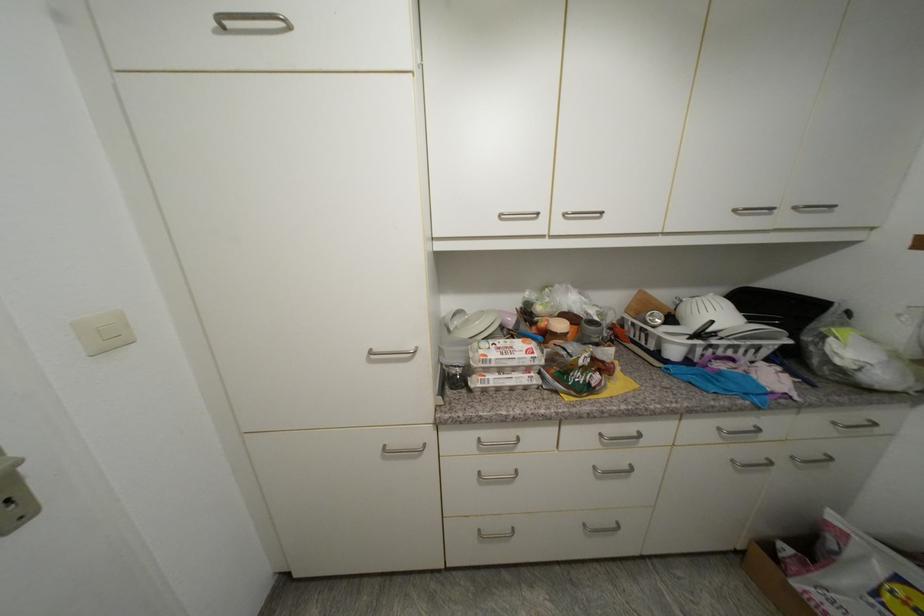
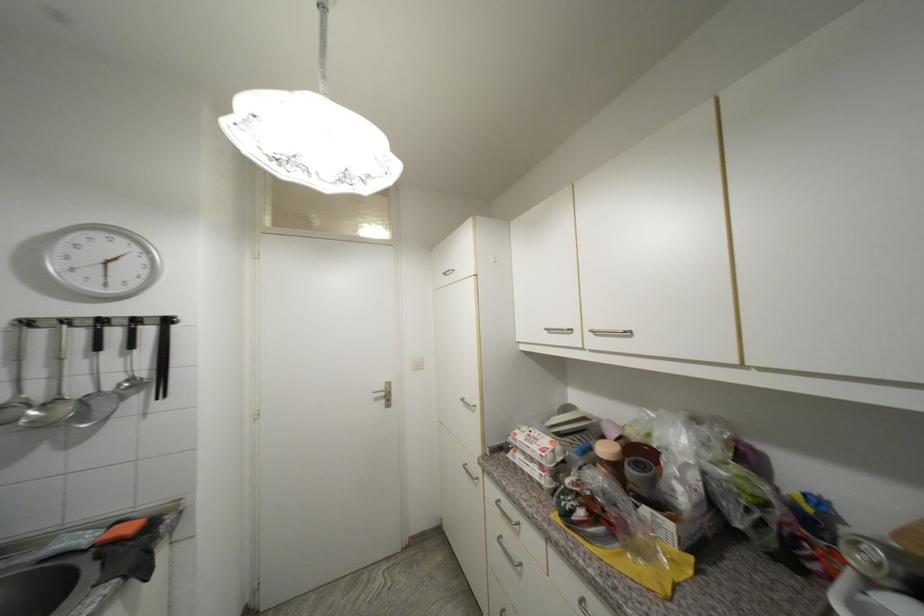
Where in the second image is the point corresponding to point 576,212 from the first image?

(601, 330)